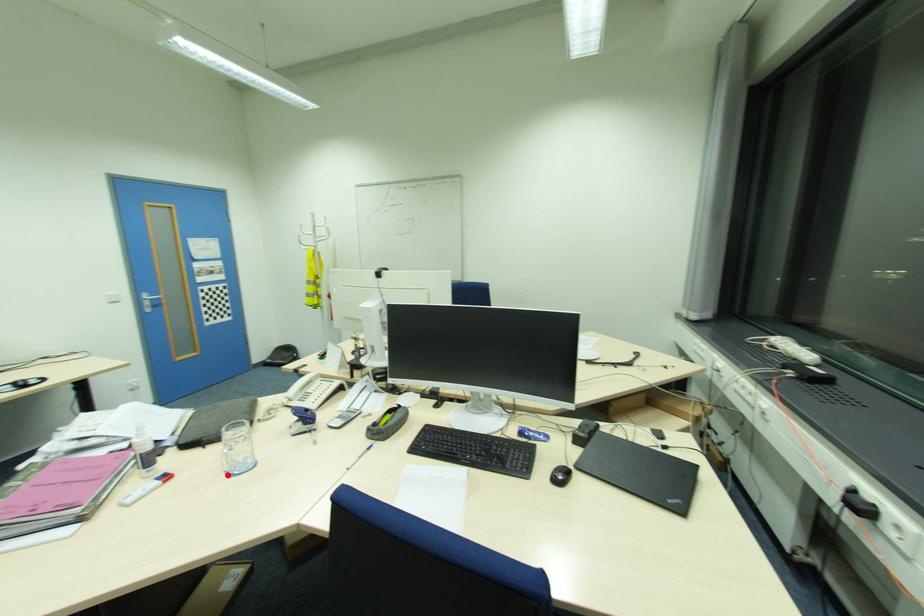
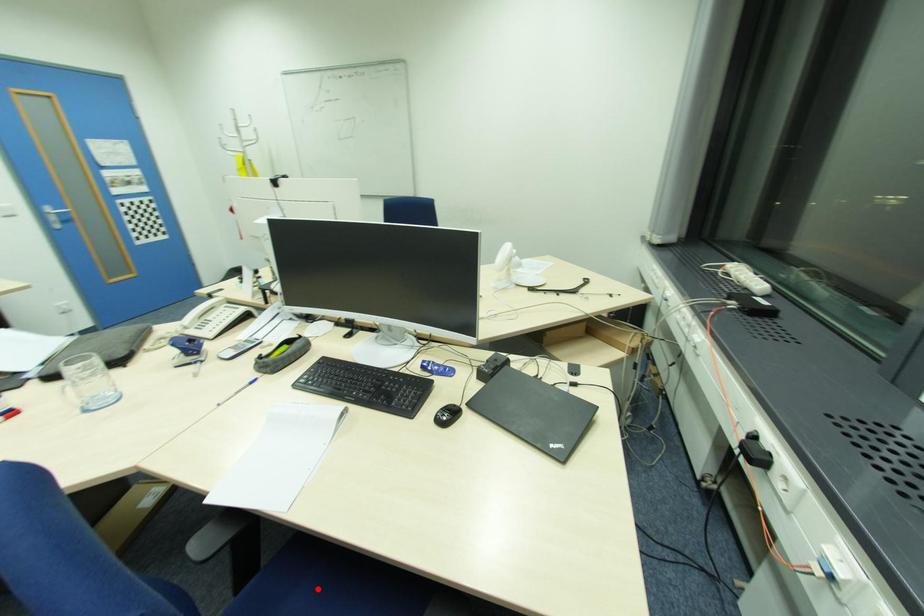
I am providing you with two images of the same scene from different viewpoints. A red point is marked on the first image and another point is marked on the second image. Is the red point in image1 aligned with the point shown in image2?

No